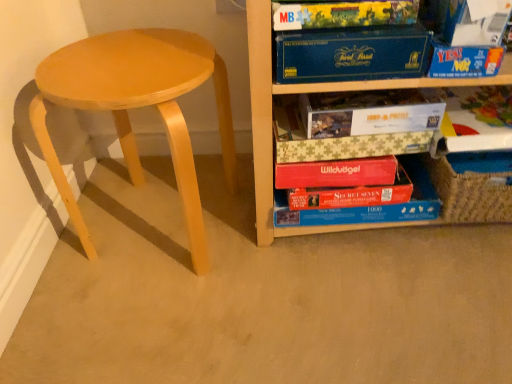
I want to click on unoccupied area in front of light wood stool at left, so click(x=203, y=327).